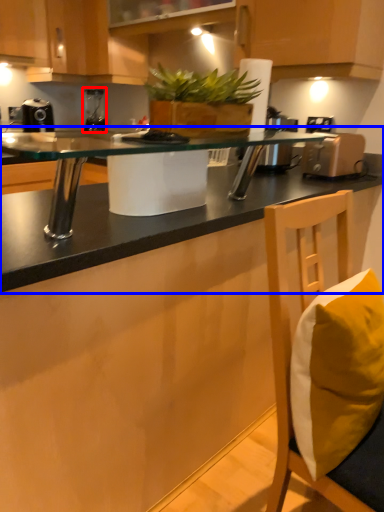
Question: Which object appears farthest to the camera in this image, coffee machine (highlighted by a red box) or countertop (highlighted by a blue box)?

Choices:
 (A) coffee machine
 (B) countertop

Answer: (A)